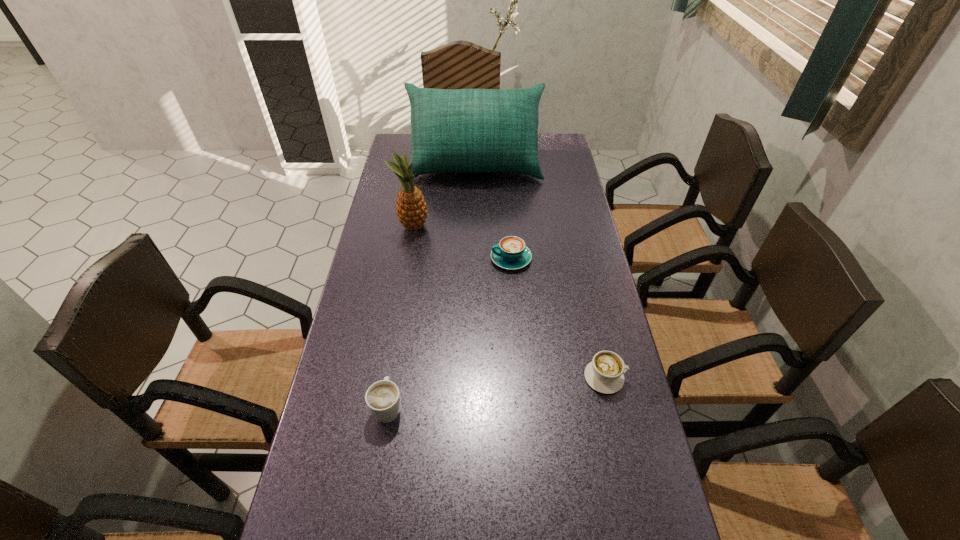
Find the location of a particular element. The width and height of the screenshot is (960, 540). free spot located with the handle on the side of the leftmost cappuccino is located at coordinates (396, 357).

This screenshot has height=540, width=960. Identify the location of vacant space located with the handle on the side of the leftmost cappuccino. (402, 314).

This screenshot has height=540, width=960. I want to click on vacant space situated with the handle on the right side of the second cappuccino from right to left, so click(x=379, y=259).

You are a GUI agent. You are given a task and a screenshot of the screen. Output one action in this format:
    pyautogui.click(x=<x>, y=<y>)
    Task: Click on the free space located 0.220m with the handle on the right side of the second cappuccino from right to left
    The image size is (960, 540).
    Given the screenshot: What is the action you would take?
    pyautogui.click(x=420, y=259)

Locate an element on the screen. This screenshot has height=540, width=960. free space located with the handle on the right side of the second cappuccino from right to left is located at coordinates (437, 259).

The image size is (960, 540). Identify the location of object that is positioned at the far edge. (465, 130).

At what (x,y) coordinates should I click in order to perform the action: click on cushion at the left edge. Please return your answer as a coordinate pair (x, y). This screenshot has height=540, width=960. Looking at the image, I should click on (465, 130).

Locate an element on the screen. pineapple situated at the left edge is located at coordinates (411, 207).

This screenshot has height=540, width=960. In order to click on cappuccino that is at the left edge in this screenshot , I will do `click(383, 399)`.

Locate an element on the screen. This screenshot has height=540, width=960. cushion present at the right edge is located at coordinates (465, 130).